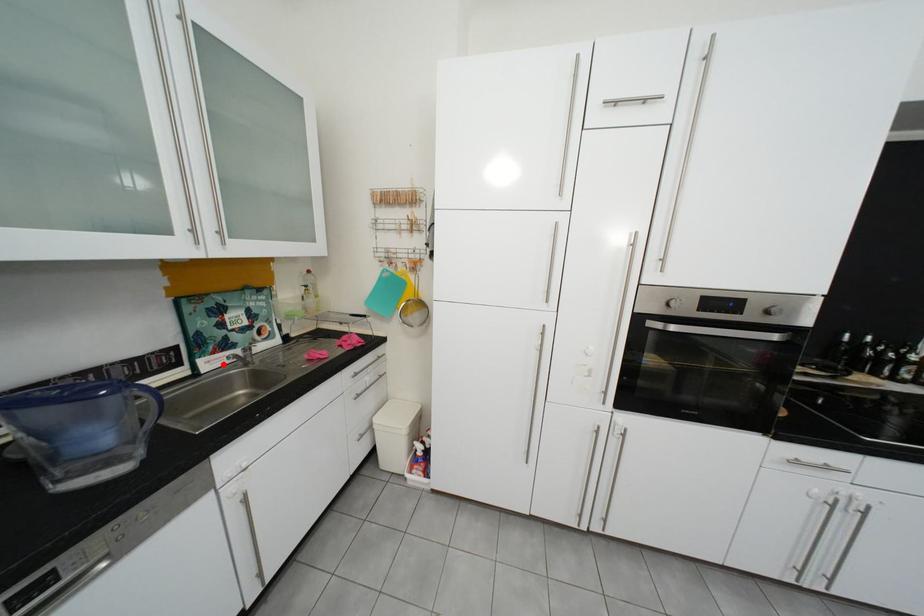
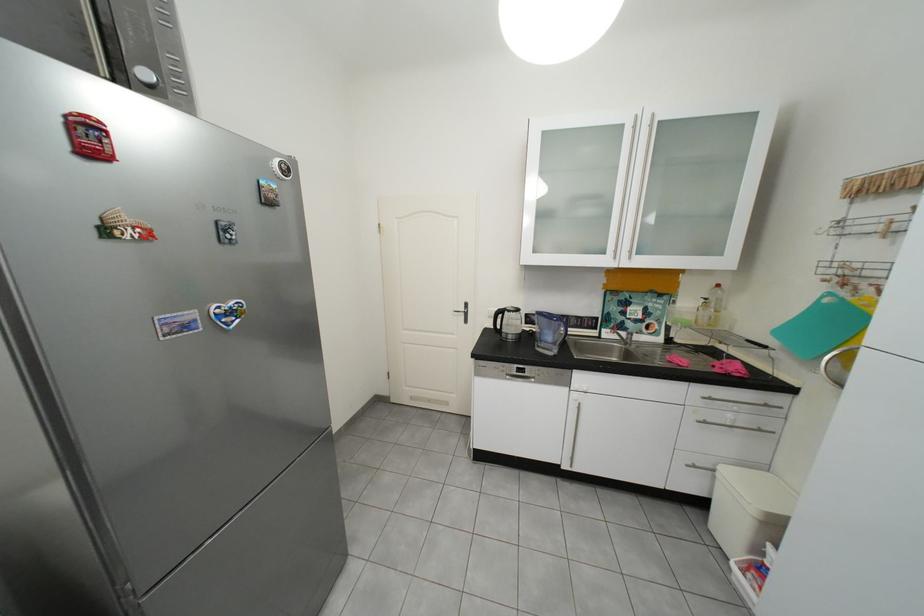
In the second image, find the point that corresponds to the highlighted location in the first image.

(619, 334)